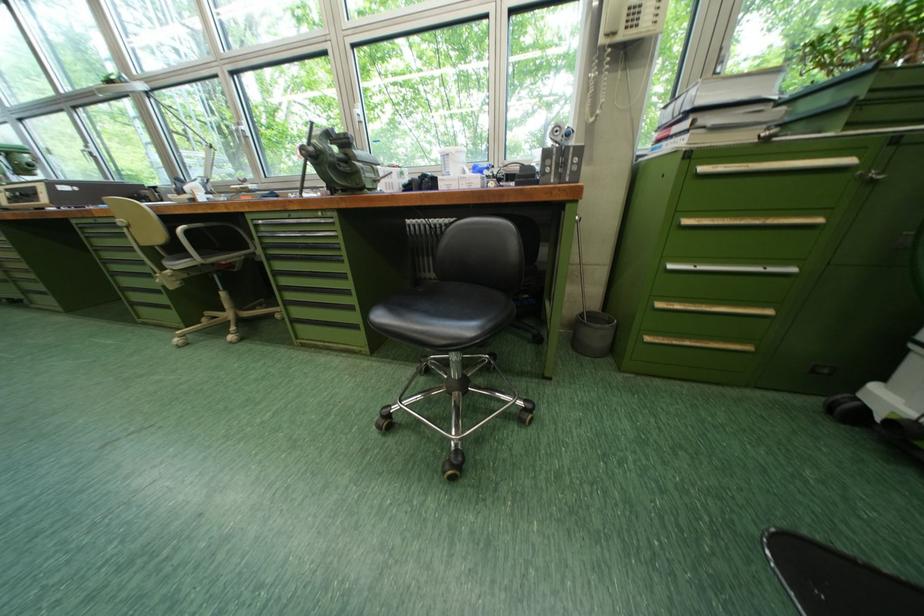
Where is `telephone handset`? Image resolution: width=924 pixels, height=616 pixels. telephone handset is located at coordinates (612, 15).